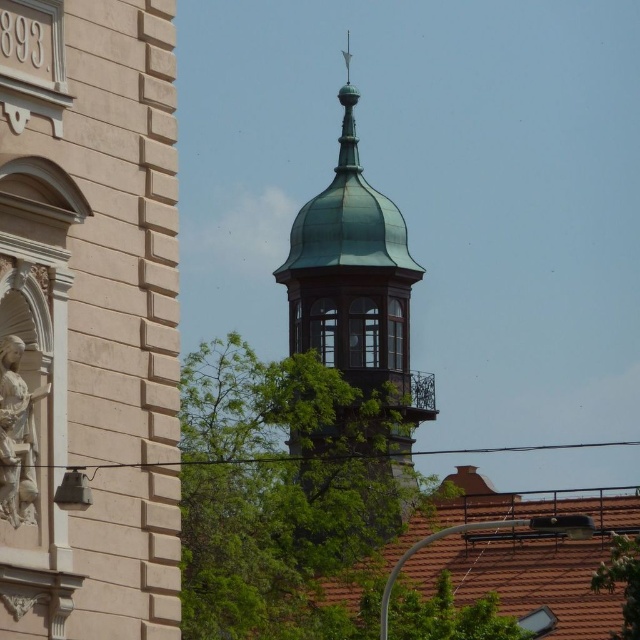
You are an architect examining the building layout. From your vantage point, does the matte beige church at left appear to be directly below the green copper dome at upper center?

Yes, the matte beige church at left is positioned under the green copper dome at upper center, so it does appear directly below it.

You are an architect examining the building. You need to determine which object is taller between the green copper dome at upper center and the white marble statue at left. Based on the scene, which one is taller?

The green copper dome at upper center is taller than the white marble statue at left.

From the picture: You are an architect analyzing the layout of this historical site. From your vantage point, which object is positioned to the right of the other between the matte beige church at left and the white marble statue at left?

The matte beige church at left is positioned to the right of the white marble statue at left.